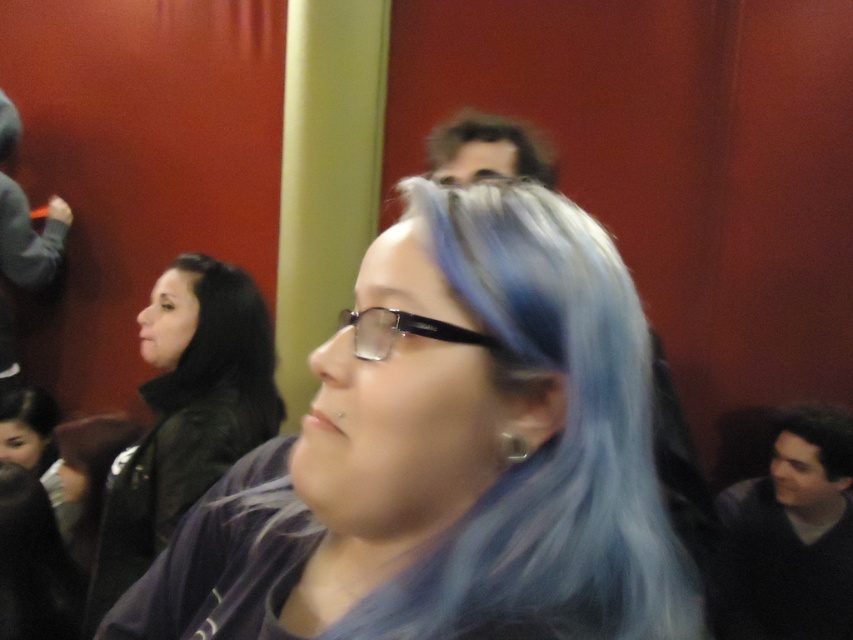
The width and height of the screenshot is (853, 640). I want to click on black leather jacket at upper left, so click(x=186, y=413).

Does black leather jacket at upper left appear over dark brown hair at upper center?

No.

Describe the element at coordinates (186, 413) in the screenshot. The height and width of the screenshot is (640, 853). I see `black leather jacket at upper left` at that location.

Locate an element on the screen. black leather jacket at upper left is located at coordinates (186, 413).

How much distance is there between dark gray sweater at center and black plastic glasses at center?

dark gray sweater at center is 6.08 feet from black plastic glasses at center.

Between point (776, 573) and point (376, 314), which one is positioned behind?

The point (776, 573) is more distant.

Who is more forward, (788, 560) or (421, 324)?

Positioned in front is point (421, 324).

Find the location of a particular element. dark gray sweater at center is located at coordinates (791, 536).

Is the position of dark gray sweater at center less distant than that of dark brown hair at upper center?

No, it is not.

How far apart are dark gray sweater at center and dark brown hair at upper center?

dark gray sweater at center is 1.20 meters from dark brown hair at upper center.

Identify the location of dark gray sweater at center. (791, 536).